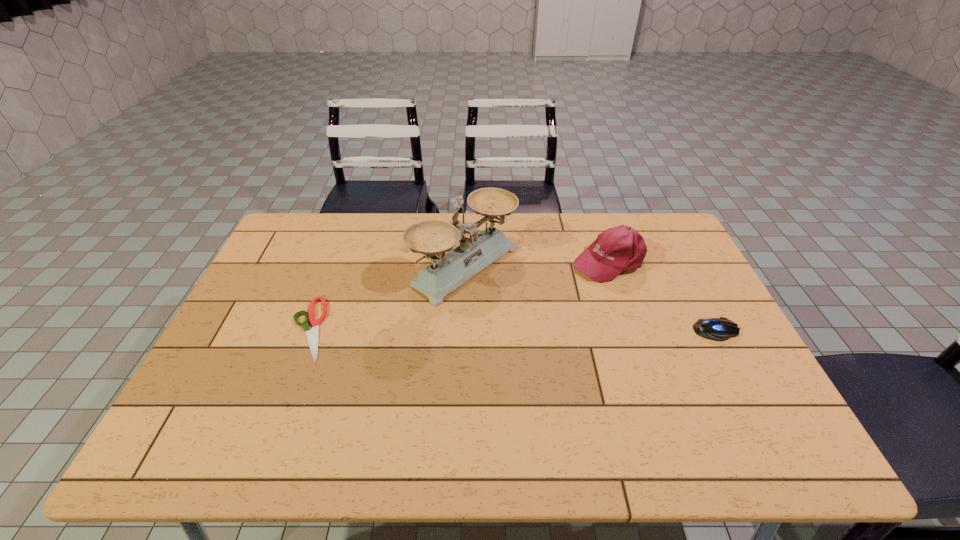
Find the location of a particular element. This screenshot has width=960, height=540. vacant space at the far edge of the desktop is located at coordinates (467, 221).

You are a GUI agent. You are given a task and a screenshot of the screen. Output one action in this format:
    pyautogui.click(x=<x>, y=<y>)
    Task: Click on the vacant space at the near edge of the desktop
    This screenshot has width=960, height=540.
    Given the screenshot: What is the action you would take?
    pyautogui.click(x=486, y=397)

This screenshot has height=540, width=960. Identify the location of vacant area at the left edge of the desktop. (245, 332).

Locate an element on the screen. free space at the right edge is located at coordinates (685, 338).

In the image, there is a desktop. Identify the location of vacant space at the far left corner. (331, 229).

In the image, there is a desktop. Where is `free space at the far right corner`? free space at the far right corner is located at coordinates (643, 235).

Where is `vacant area at the near right corner`? vacant area at the near right corner is located at coordinates (761, 389).

Locate an element on the screen. blank region between the third object from right to left and the baseball cap is located at coordinates (537, 264).

This screenshot has width=960, height=540. Find the location of `vacant point located between the computer mouse and the third object from right to left`. vacant point located between the computer mouse and the third object from right to left is located at coordinates (591, 299).

Find the location of `blank region between the computer mouse and the scissors`. blank region between the computer mouse and the scissors is located at coordinates (512, 330).